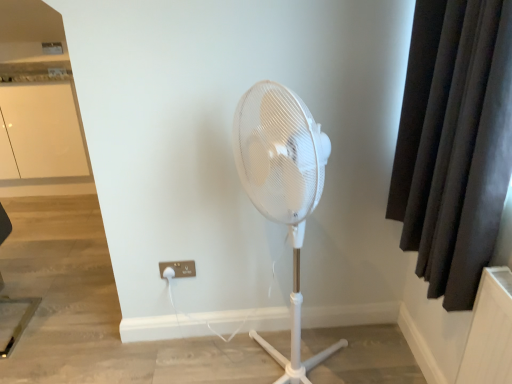
Question: From a real-world perspective, is dark fabric curtain at right below white plastic electric outlet at lower center?

Choices:
 (A) yes
 (B) no

Answer: (B)

Question: From the image's perspective, is dark fabric curtain at right under white plastic electric outlet at lower center?

Choices:
 (A) yes
 (B) no

Answer: (B)

Question: Considering the relative sizes of dark fabric curtain at right and white plastic electric outlet at lower center in the image provided, is dark fabric curtain at right bigger than white plastic electric outlet at lower center?

Choices:
 (A) yes
 (B) no

Answer: (A)

Question: Is white plastic electric outlet at lower center surrounded by dark fabric curtain at right?

Choices:
 (A) no
 (B) yes

Answer: (A)

Question: Does dark fabric curtain at right have a lesser height compared to white plastic electric outlet at lower center?

Choices:
 (A) yes
 (B) no

Answer: (B)

Question: Do you think dark fabric curtain at right is within white glossy cabinet at upper left, or outside of it?

Choices:
 (A) inside
 (B) outside

Answer: (B)

Question: From the image's perspective, relative to white glossy cabinet at upper left, is dark fabric curtain at right above or below?

Choices:
 (A) above
 (B) below

Answer: (B)

Question: Is dark fabric curtain at right in front of or behind white glossy cabinet at upper left in the image?

Choices:
 (A) behind
 (B) front

Answer: (B)

Question: Based on their positions, is dark fabric curtain at right located to the left or right of white glossy cabinet at upper left?

Choices:
 (A) right
 (B) left

Answer: (A)

Question: In the image, is white glossy cabinet at upper left positioned in front of or behind white plastic electric outlet at lower center?

Choices:
 (A) front
 (B) behind

Answer: (B)

Question: Is point pyautogui.click(x=39, y=107) closer or farther from the camera than point pyautogui.click(x=176, y=273)?

Choices:
 (A) closer
 (B) farther

Answer: (B)

Question: From their relative heights in the image, would you say white glossy cabinet at upper left is taller or shorter than white plastic electric outlet at lower center?

Choices:
 (A) tall
 (B) short

Answer: (A)

Question: From the image's perspective, relative to white plastic electric outlet at lower center, is white glossy cabinet at upper left above or below?

Choices:
 (A) below
 (B) above

Answer: (B)

Question: Considering the relative positions of white glossy cabinet at upper left and dark fabric curtain at right in the image provided, is white glossy cabinet at upper left to the left or to the right of dark fabric curtain at right?

Choices:
 (A) left
 (B) right

Answer: (A)

Question: From the image's perspective, is white glossy cabinet at upper left above or below dark fabric curtain at right?

Choices:
 (A) below
 (B) above

Answer: (B)